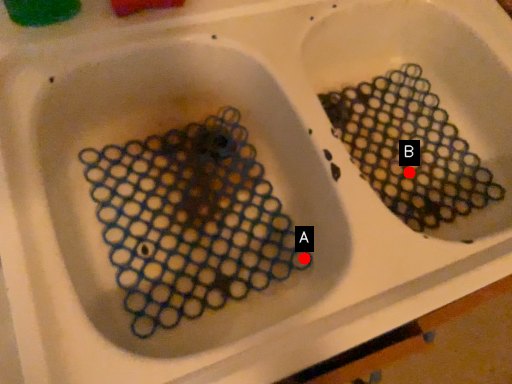
Question: Two points are circled on the image, labeled by A and B beside each circle. Which of the following is the closest to the observer?

Choices:
 (A) A is closer
 (B) B is closer

Answer: (A)